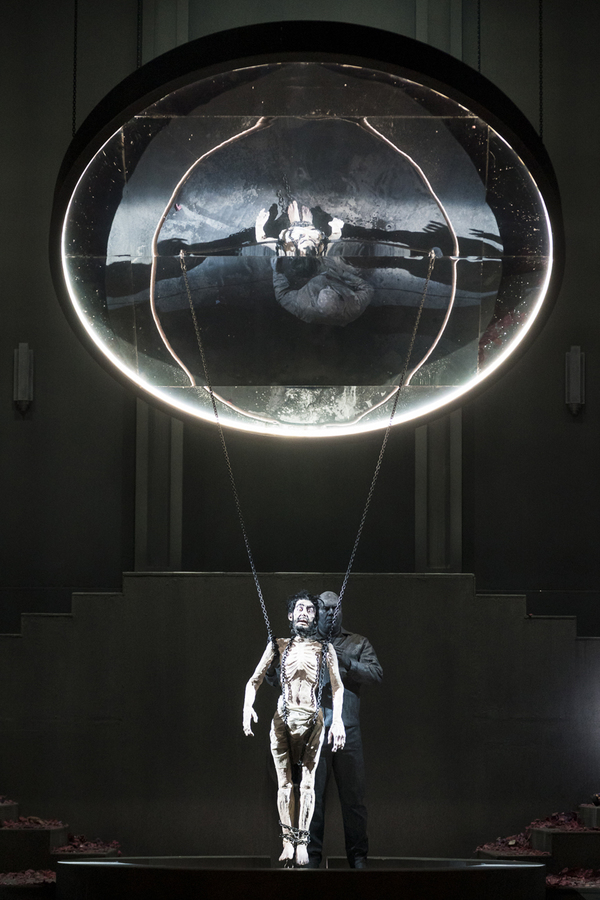
Locate an element on the screen. This screenshot has width=600, height=900. wall light fixtures is located at coordinates (577, 378), (24, 370).